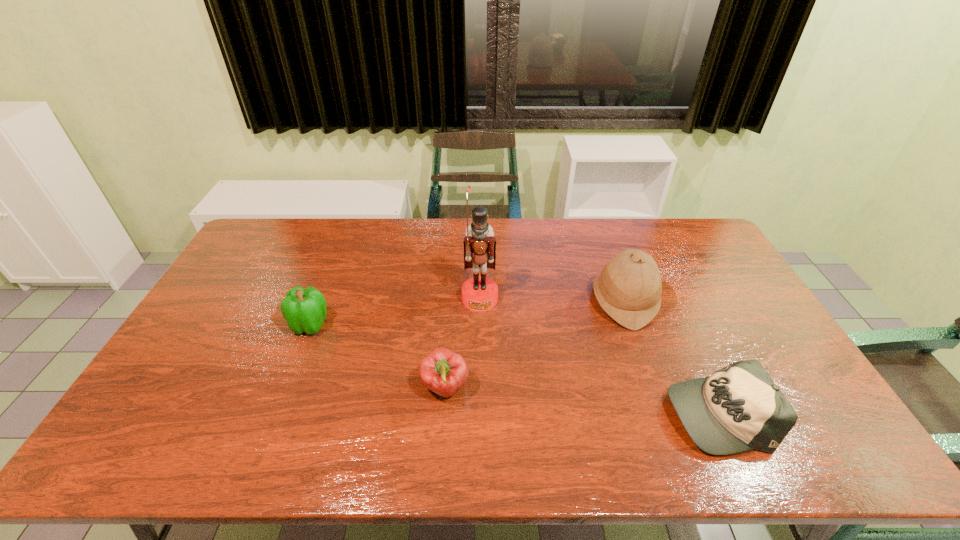
Where is `nutcracker`? nutcracker is located at coordinates tap(479, 293).

Where is `hat`? The width and height of the screenshot is (960, 540). hat is located at coordinates (629, 288).

Where is `the left bell pepper`? The height and width of the screenshot is (540, 960). the left bell pepper is located at coordinates (304, 310).

Where is `the leftmost object`? The image size is (960, 540). the leftmost object is located at coordinates (304, 310).

This screenshot has width=960, height=540. What are the coordinates of `the shorter bell pepper` in the screenshot? It's located at (444, 372).

In order to click on the right bell pepper in this screenshot , I will do `click(444, 372)`.

Where is `baseball cap`? This screenshot has width=960, height=540. baseball cap is located at coordinates (738, 408).

Locate an element on the screen. This screenshot has height=540, width=960. vacant area located 0.060m on the front-facing side of the tallest object is located at coordinates (480, 326).

In order to click on vacant point located 0.100m on the front-facing side of the hat in this screenshot , I will do `click(561, 301)`.

You are a GUI agent. You are given a task and a screenshot of the screen. Output one action in this format:
    pyautogui.click(x=<x>, y=<y>)
    Task: Click on the free location located 0.370m on the front-facing side of the hat
    The width and height of the screenshot is (960, 540).
    Given the screenshot: What is the action you would take?
    pyautogui.click(x=476, y=301)